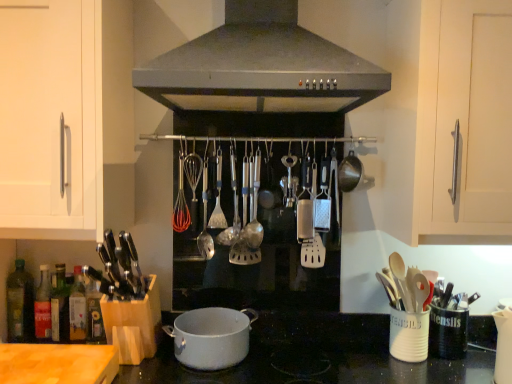
Where is `free spot above wooden cutting board at lower left (from a real-world perspective)`? The height and width of the screenshot is (384, 512). free spot above wooden cutting board at lower left (from a real-world perspective) is located at coordinates (42, 355).